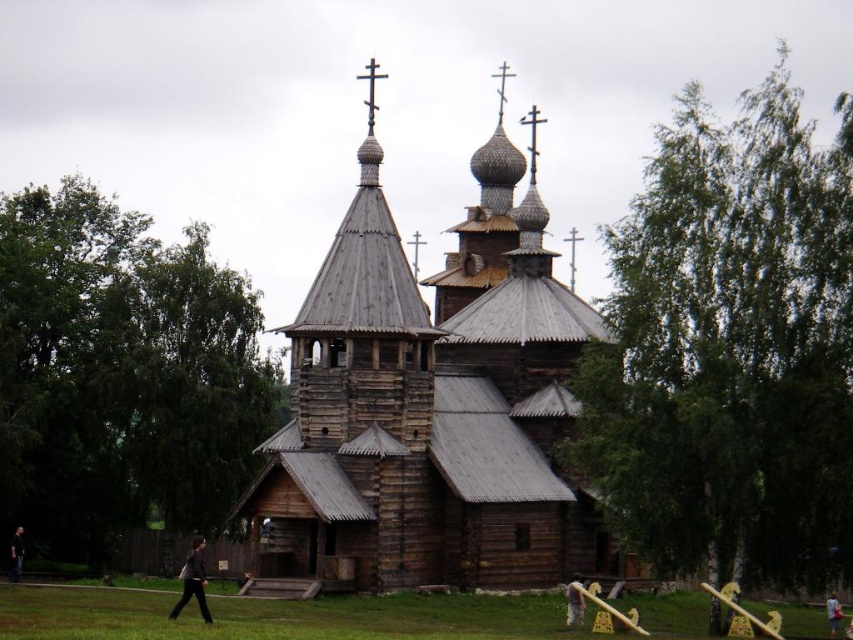
Question: Which object is the closest to the brown leather jacket at lower right?

Choices:
 (A) green grass at lower center
 (B) brown leather jacket at lower center
 (C) dark gray fabric at lower center

Answer: (B)

Question: Does dark brown wooden person at lower left appear over brown leather jacket at lower right?

Choices:
 (A) yes
 (B) no

Answer: (A)

Question: Does dark gray fabric at lower center come behind brown leather jacket at lower right?

Choices:
 (A) no
 (B) yes

Answer: (A)

Question: Which of the following is the farthest from the observer?

Choices:
 (A) wooden church at center
 (B) brown leather jacket at lower center
 (C) brown leather jacket at lower right
 (D) green grass at lower center

Answer: (C)

Question: Estimate the real-world distances between objects in this image. Which object is farther from the dark brown wooden person at lower left?

Choices:
 (A) dark gray fabric at lower center
 (B) brown leather jacket at lower right
 (C) green grass at lower center

Answer: (B)

Question: Can you confirm if dark gray fabric at lower center is smaller than brown leather jacket at lower right?

Choices:
 (A) yes
 (B) no

Answer: (B)